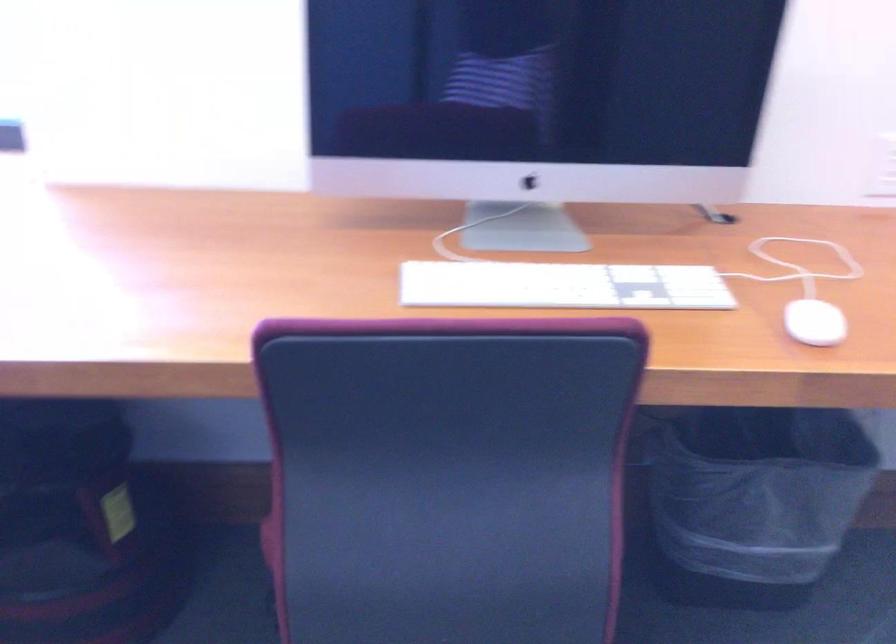
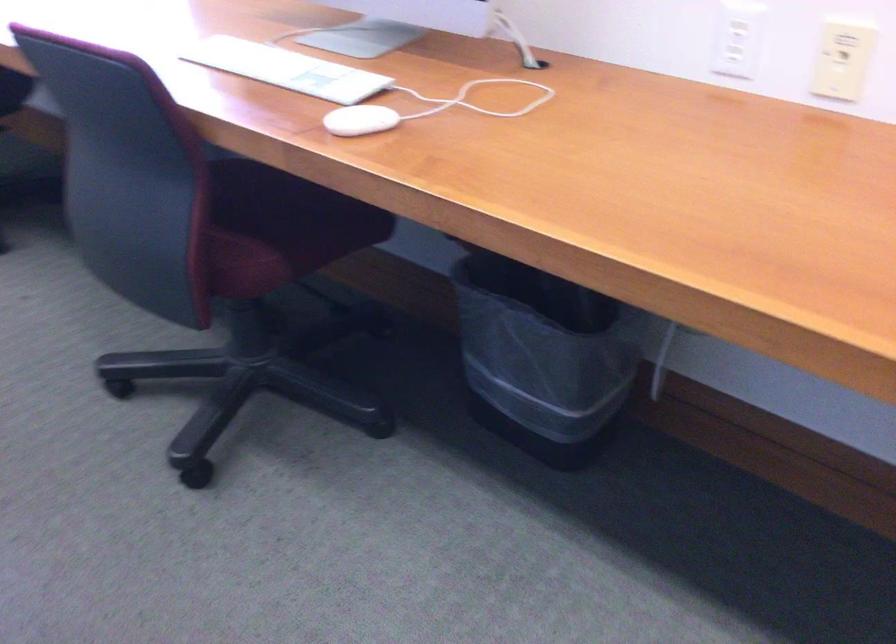
Locate, in the second image, the point that corresponds to (x=821, y=317) in the first image.

(359, 120)